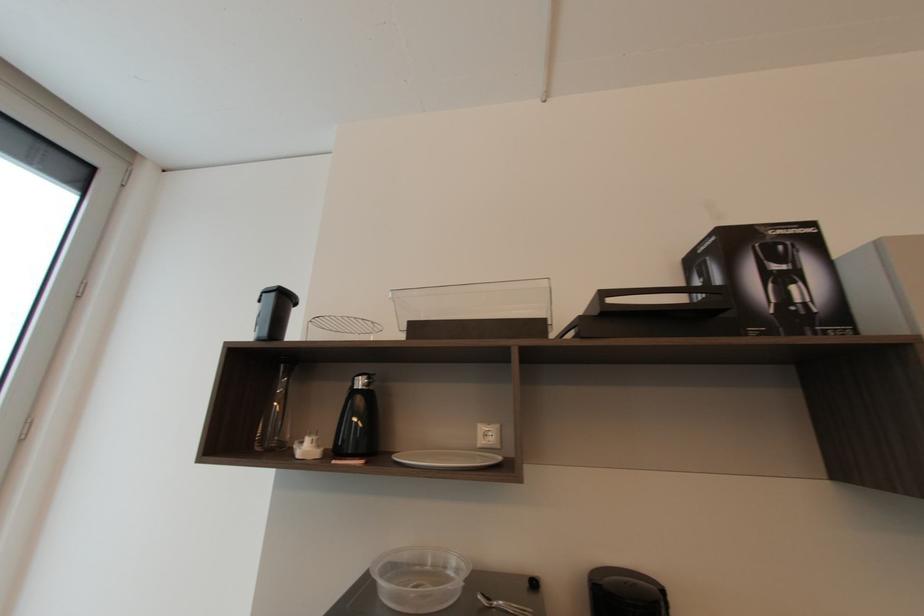
In order to click on black thermos pump in this screenshot , I will do `click(358, 421)`.